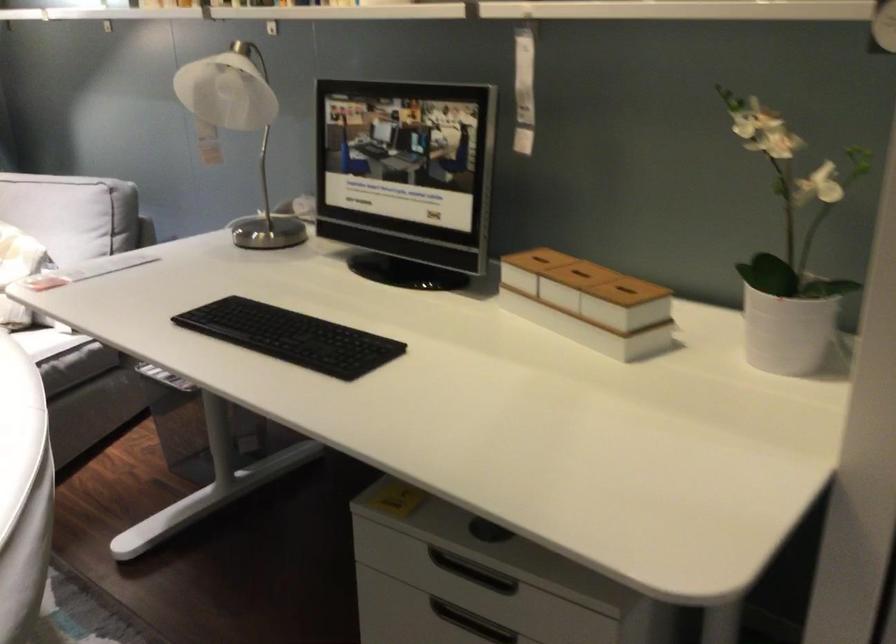
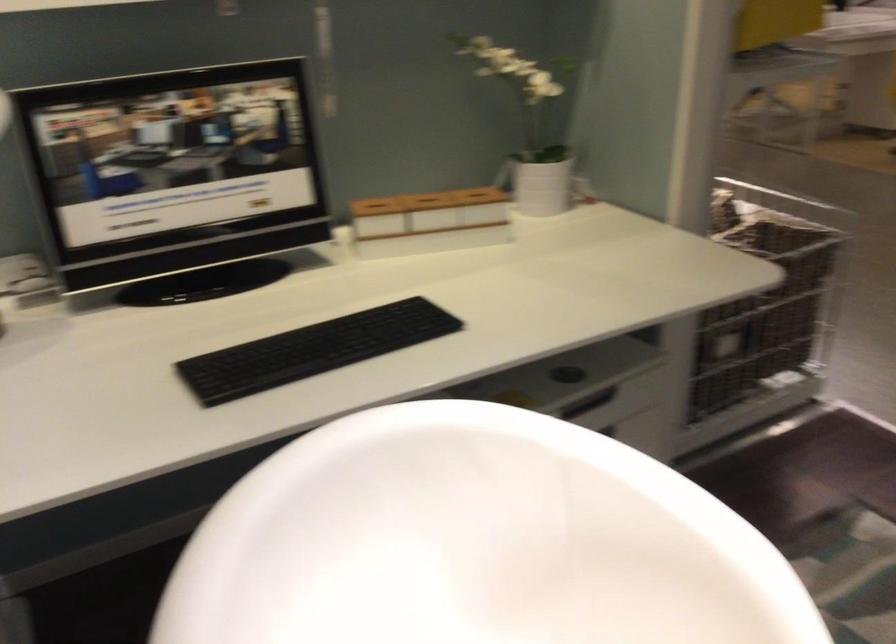
Find the pixel in the second image that matches (x=622, y=283) in the first image.

(474, 193)